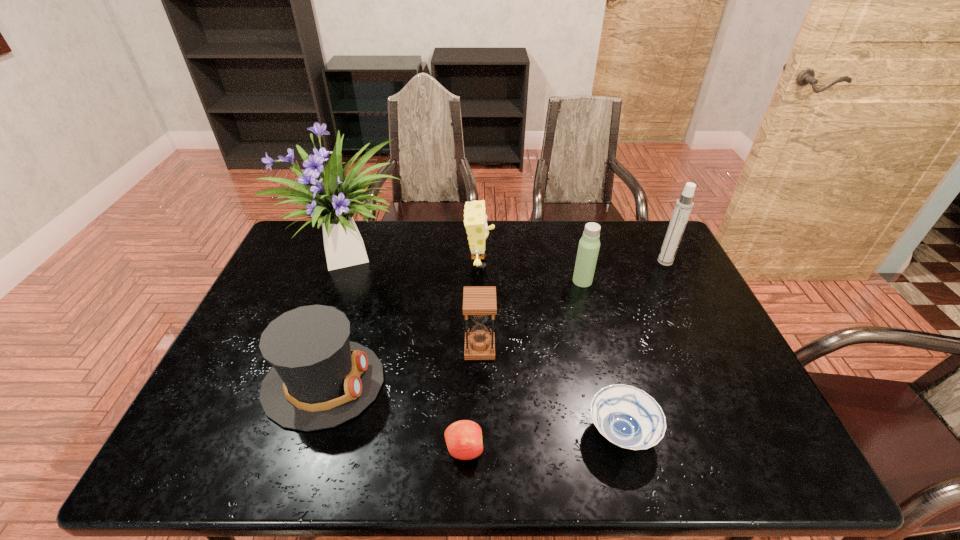
At what (x,y) coordinates should I click in order to perform the action: click on apple that is positioned at the near edge. Please return your answer as a coordinate pair (x, y). The width and height of the screenshot is (960, 540). Looking at the image, I should click on (463, 438).

The image size is (960, 540). In order to click on soup bowl that is at the near edge in this screenshot , I will do `click(628, 417)`.

Find the location of a particular element. flower arrangement that is at the left edge is located at coordinates (336, 199).

Locate an element on the screen. The width and height of the screenshot is (960, 540). dress hat located at the left edge is located at coordinates [319, 379].

Locate an element on the screen. The image size is (960, 540). object that is at the right edge is located at coordinates (684, 205).

Image resolution: width=960 pixels, height=540 pixels. In order to click on object present at the far left corner in this screenshot , I will do `click(336, 199)`.

At what (x,y) coordinates should I click in order to perform the action: click on object that is positioned at the far right corner. Please return your answer as a coordinate pair (x, y). The image size is (960, 540). Looking at the image, I should click on pos(684,205).

Where is `vacant area at the far edge of the desktop`? vacant area at the far edge of the desktop is located at coordinates (605, 236).

Where is `blank space at the near edge of the desktop`? blank space at the near edge of the desktop is located at coordinates (552, 458).

In the image, there is a desktop. At what (x,y) coordinates should I click in order to perform the action: click on vacant space at the right edge. Please return your answer as a coordinate pair (x, y). This screenshot has width=960, height=540. Looking at the image, I should click on (681, 280).